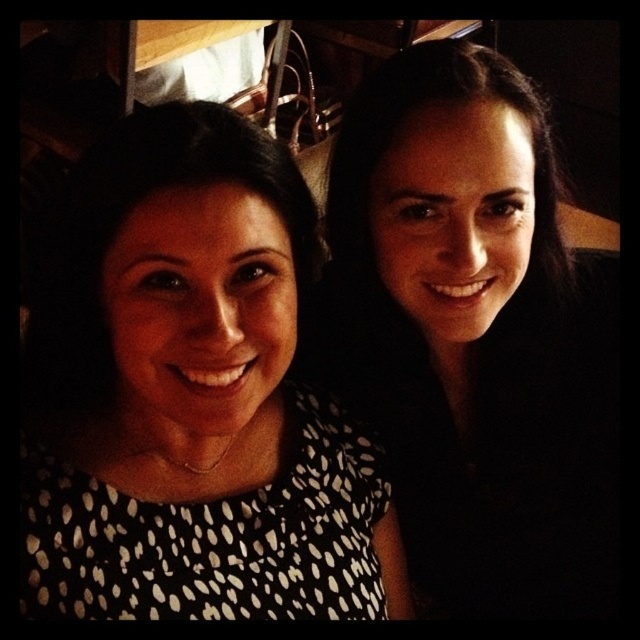
Which is in front, point (161, 164) or point (396, 394)?

Point (161, 164) is more forward.

Between white dotted dress at center and black dotted dress at upper right, which one is positioned lower?

white dotted dress at center is below.

Consider the image. Who is more forward, (90, 364) or (509, 246)?

Point (90, 364) is more forward.

Locate an element on the screen. white dotted dress at center is located at coordinates (189, 396).